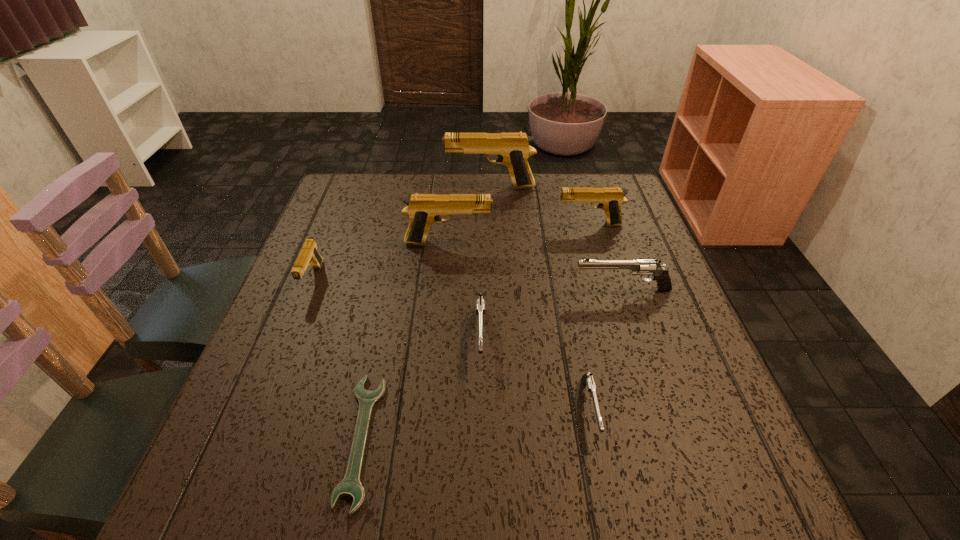
Find the location of a particular element. object present at the near edge is located at coordinates (350, 486).

I want to click on object at the left edge, so click(309, 254).

Locate an element on the screen. free space at the far edge of the desktop is located at coordinates (557, 204).

Locate an element on the screen. The image size is (960, 540). free space at the near edge of the desktop is located at coordinates (364, 515).

Identify the location of free location at the left edge of the desktop. point(359,286).

You are a GUI agent. You are given a task and a screenshot of the screen. Output one action in this format:
    pyautogui.click(x=<x>, y=<y>)
    Task: Click on the free space at the right edge of the desktop
    Image resolution: width=960 pixels, height=540 pixels.
    Given the screenshot: What is the action you would take?
    pyautogui.click(x=733, y=425)

Find the location of `free space at the far left corner of the desktop`. free space at the far left corner of the desktop is located at coordinates (379, 184).

In the image, there is a desktop. Where is `vacant space at the near left corner`? This screenshot has height=540, width=960. vacant space at the near left corner is located at coordinates (275, 478).

What are the coordinates of `free area in between the wrench and the leftmost silver pistol` in the screenshot? It's located at (420, 388).

Locate an element on the screen. This screenshot has height=540, width=960. free spot between the sixth shortest pistol and the tallest object is located at coordinates (469, 215).